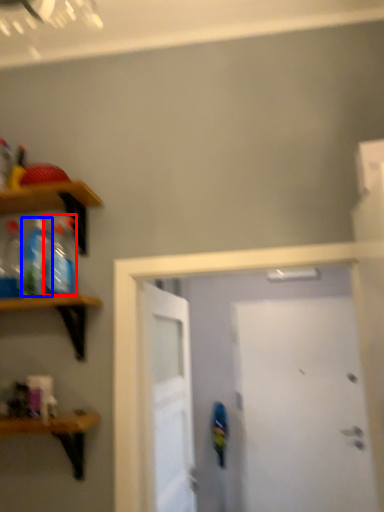
Question: Which point is further to the camera, bottle (highlighted by a red box) or bottle (highlighted by a blue box)?

Choices:
 (A) bottle
 (B) bottle

Answer: (B)